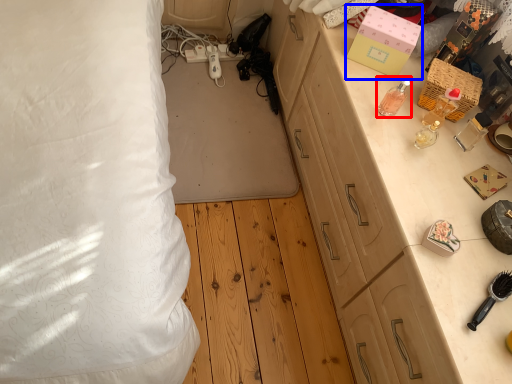
Question: Which of the following is the closest to the observer, perfume (highlighted by a red box) or box (highlighted by a blue box)?

Choices:
 (A) perfume
 (B) box

Answer: (A)